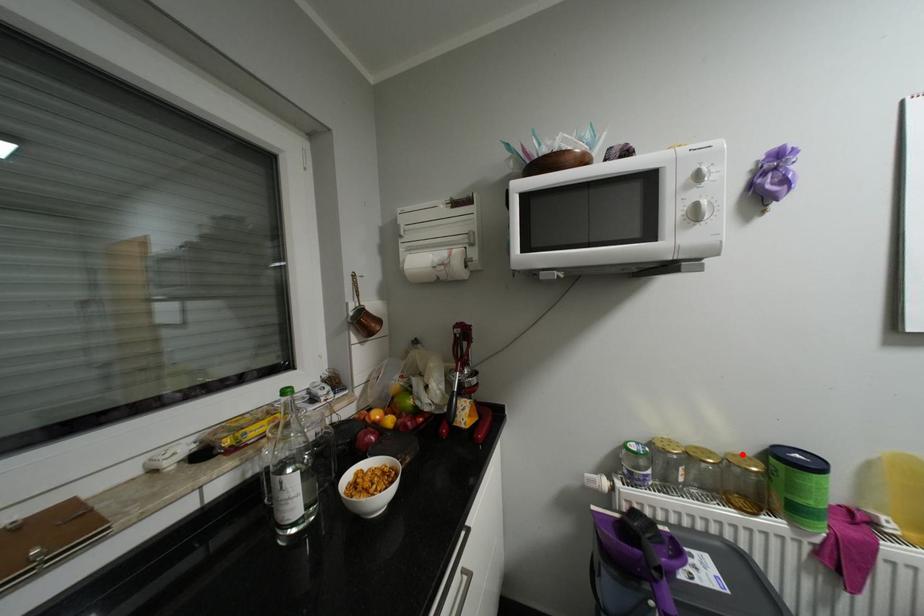
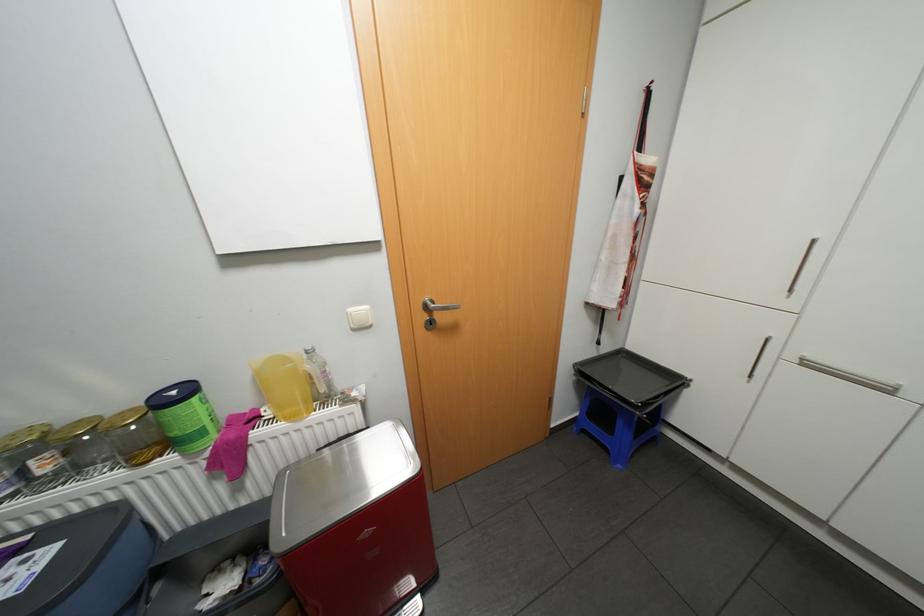
In the second image, find the point that corresponds to the highlighted location in the first image.

(128, 411)